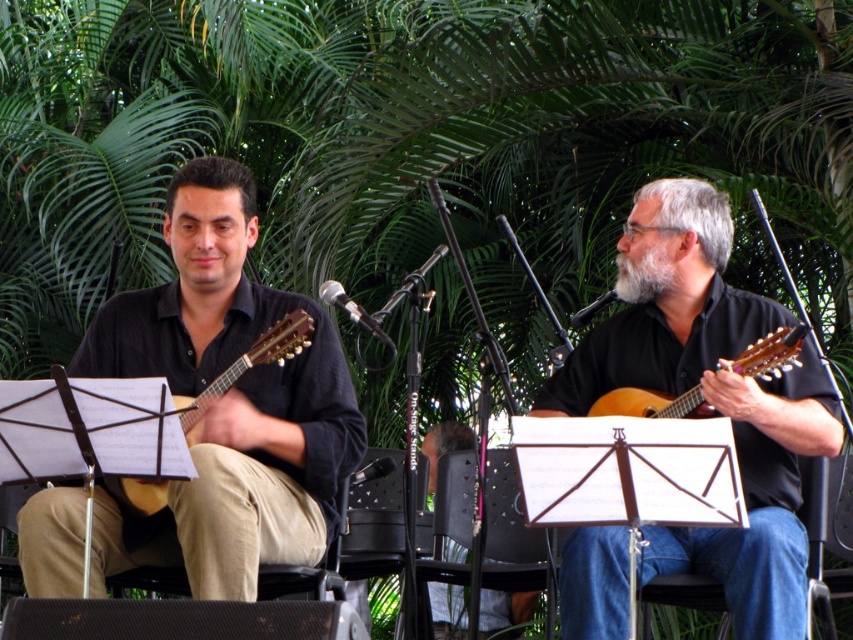
Which is in front, point (254, 365) or point (659, 403)?

Positioned in front is point (254, 365).

Who is lower down, wooden acoustic guitar at left or matte wood guitar at right?

wooden acoustic guitar at left

Measure the distance between point [306,317] and camera.

Point [306,317] and camera are 3.66 meters apart.

Where is `wooden acoustic guitar at left`? The height and width of the screenshot is (640, 853). wooden acoustic guitar at left is located at coordinates (247, 365).

Where is `matte black guitar at left`? matte black guitar at left is located at coordinates (225, 403).

Between matte black guitar at left and wooden acoustic guitar at left, which one has less height?

wooden acoustic guitar at left is shorter.

Who is more forward, (x=248, y=592) or (x=303, y=316)?

Point (x=248, y=592) is more forward.

This screenshot has height=640, width=853. In order to click on matte black guitar at left in this screenshot , I will do `click(225, 403)`.

Is point (222, 538) farther from viewer compared to point (697, 403)?

No, (222, 538) is in front of (697, 403).

Who is more forward, [74,552] or [643,416]?

Point [74,552] is more forward.

This screenshot has width=853, height=640. In order to click on matte black guitar at left in this screenshot , I will do `click(225, 403)`.